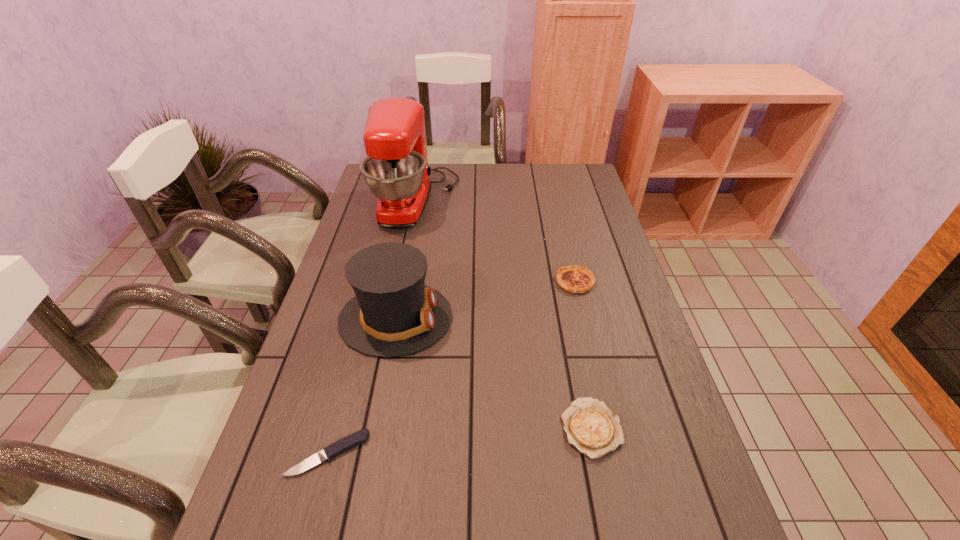
The image size is (960, 540). I want to click on the farthest object, so click(396, 170).

You are a GUI agent. You are given a task and a screenshot of the screen. Output one action in this format:
    pyautogui.click(x=<x>, y=<y>)
    Task: Click on the tallest object
    The width and height of the screenshot is (960, 540).
    Given the screenshot: What is the action you would take?
    pyautogui.click(x=396, y=170)

Locate an element on the screen. The height and width of the screenshot is (540, 960). dress hat is located at coordinates (394, 313).

The image size is (960, 540). Identify the location of the taller quiche. (575, 279).

Where is `the third tallest object`? the third tallest object is located at coordinates (575, 279).

Locate an element on the screen. the shorter quiche is located at coordinates (591, 427).

Locate an element on the screen. Image resolution: width=960 pixels, height=540 pixels. steak knife is located at coordinates (361, 436).

This screenshot has width=960, height=540. Find the location of `free point located on the front-facing side of the tallest object`. free point located on the front-facing side of the tallest object is located at coordinates (471, 201).

At what (x,y) coordinates should I click in order to perform the action: click on free spot located with goggles on the front of the second tallest object. Please return your answer as a coordinate pair (x, y). Looking at the image, I should click on (561, 318).

Identify the location of vacant space situated 0.240m on the back of the taller quiche. (562, 224).